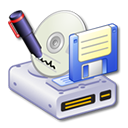
You are a GUI agent. You are given a task and a screenshot of the screen. Output one action in this format:
    pyautogui.click(x=<x>, y=<y>)
    Task: Click on the pen or marker
    The height and width of the screenshot is (128, 128).
    Given the screenshot: What is the action you would take?
    pyautogui.click(x=33, y=39)